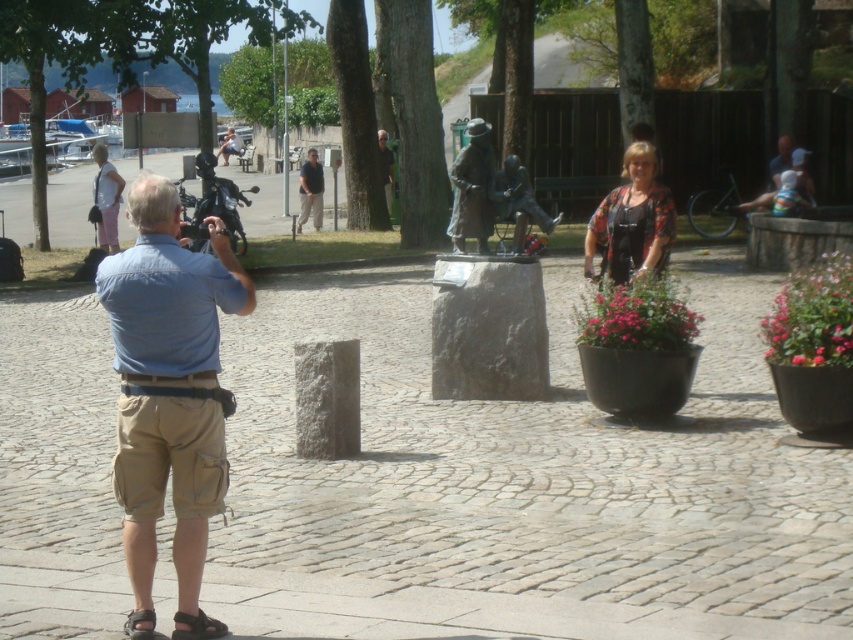
Question: Which object is closer to the camera taking this photo?

Choices:
 (A) dark blue shirt at center
 (B) bronze statue at center

Answer: (B)

Question: Is khaki shorts at left positioned behind matte pink dress at left?

Choices:
 (A) no
 (B) yes

Answer: (A)

Question: From the image, what is the correct spatial relationship of khaki shorts at left in relation to matte pink dress at left?

Choices:
 (A) left
 (B) right

Answer: (B)

Question: From the image, what is the correct spatial relationship of matte pink dress at left in relation to matte black statue at center?

Choices:
 (A) above
 (B) below

Answer: (B)

Question: Which object is positioned closest to the dark blue shirt at center?

Choices:
 (A) matte black statue at center
 (B) floral-patterned blouse at center
 (C) bronze statue at center
 (D) matte pink dress at left

Answer: (A)

Question: Which of the following is the farthest from the observer?

Choices:
 (A) (471, 163)
 (B) (109, 163)
 (C) (646, 196)
 (D) (387, 182)

Answer: (B)